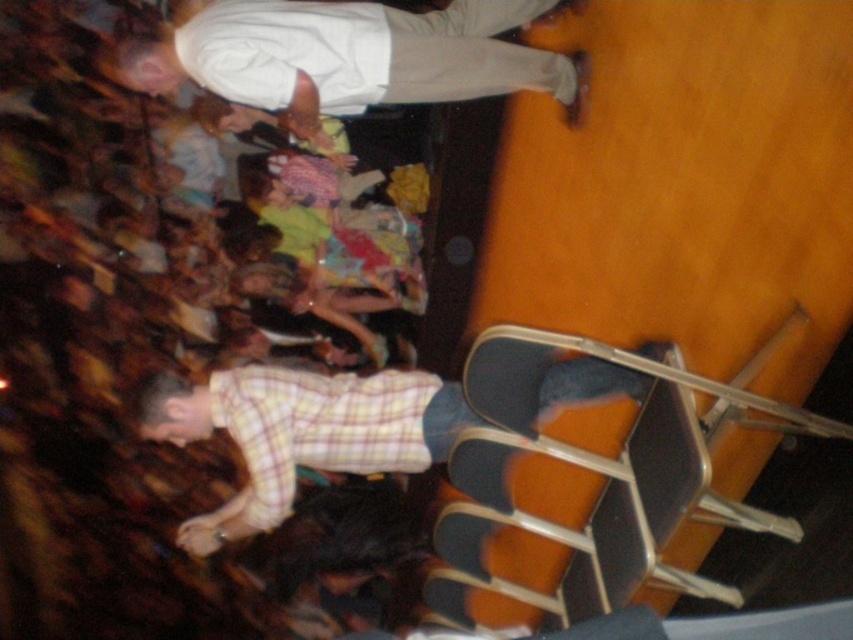
Is black plastic chair at lower right below light beige pants at upper center?

Yes.

Is point (480, 580) positioned behind point (556, 54)?

No, it is not.

In order to click on black plastic chair at lower right in this screenshot , I will do `click(596, 474)`.

Who is more forward, (547, 385) or (404, 394)?

Positioned in front is point (547, 385).

Does yellow plaid shirt at center have a greater width compared to yellow plaid shirt at lower left?

Yes.

Is point (585, 400) closer to camera compared to point (257, 444)?

Yes, point (585, 400) is closer to viewer.

Find the location of `yellow plaid shirt at center`. yellow plaid shirt at center is located at coordinates (300, 433).

Does light beige pants at upper center have a lesser width compared to yellow plaid shirt at center?

Correct, light beige pants at upper center's width is less than yellow plaid shirt at center's.

Is light beige pants at upper center to the right of yellow plaid shirt at center from the viewer's perspective?

No, light beige pants at upper center is not to the right of yellow plaid shirt at center.

Does point (231, 76) come in front of point (267, 458)?

Yes, point (231, 76) is closer to viewer.

Where is `light beige pants at upper center`? The height and width of the screenshot is (640, 853). light beige pants at upper center is located at coordinates (351, 56).